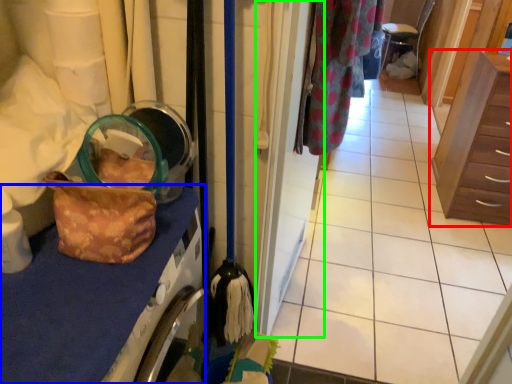
Question: Based on their relative distances, which object is farther from chest of drawers (highlighted by a red box)? Choose from counter top (highlighted by a blue box) and door (highlighted by a green box).

Choices:
 (A) counter top
 (B) door

Answer: (A)